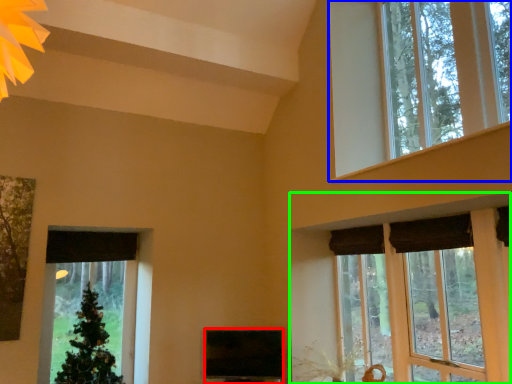
Question: Which object is positioned farthest from window screen (highlighted by a red box)? Select from window (highlighted by a blue box) and window (highlighted by a green box).

Choices:
 (A) window
 (B) window

Answer: (A)